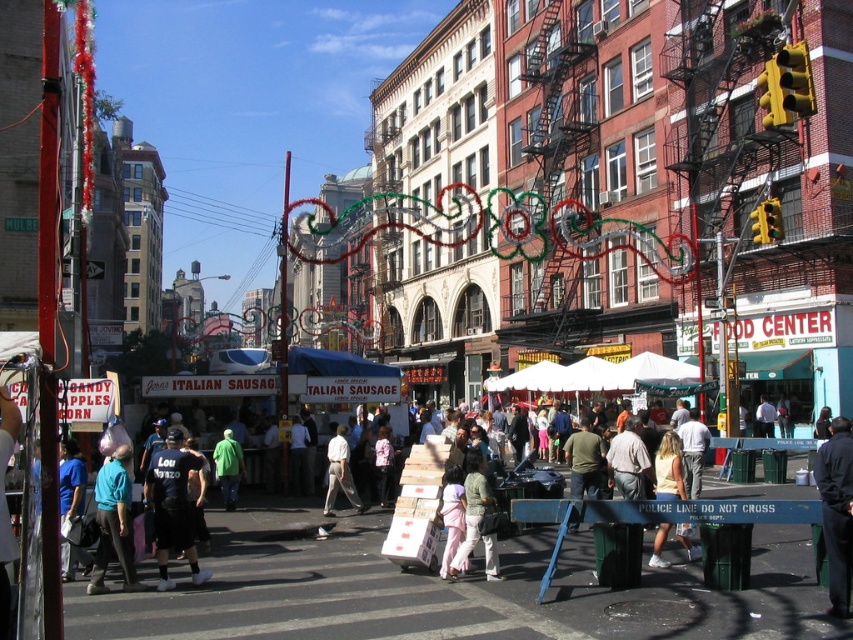
Question: Which object appears closest to the camera in this image?

Choices:
 (A) green matte jacket at center
 (B) light green fabric jacket at center
 (C) dark blue fabric at center
 (D) pink silk saree at center

Answer: (C)

Question: Does black cotton t-shirt at center appear over white cotton shirt at center?

Choices:
 (A) yes
 (B) no

Answer: (A)

Question: Which point is farther from the camera taking this photo?

Choices:
 (A) pyautogui.click(x=190, y=564)
 (B) pyautogui.click(x=328, y=458)

Answer: (B)

Question: Considering the relative positions of dark blue fabric at center and white cotton shirt at center in the image provided, where is dark blue fabric at center located with respect to white cotton shirt at center?

Choices:
 (A) right
 (B) left

Answer: (A)

Question: Which point is farther from the camera taking this photo?

Choices:
 (A) (345, 429)
 (B) (671, 467)

Answer: (A)

Question: Can you confirm if dark blue fabric at center is smaller than light beige cotton dress at center?

Choices:
 (A) yes
 (B) no

Answer: (A)